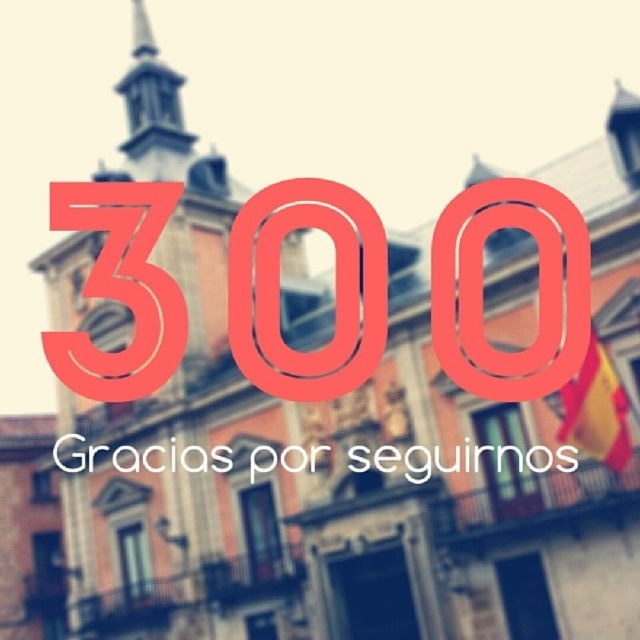
You are a tour guide explaining the architecture of the building. You point to the metallic red number at center and the smooth stone spire at upper left. Which object is shorter?

The metallic red number at center is shorter than the smooth stone spire at upper left.

You are a tour guide explaining the historic building to visitors. You point out the metallic red number at center and the smooth stone spire at upper left. Which one do you mention is larger?

The smooth stone spire at upper left is larger than the metallic red number at center.